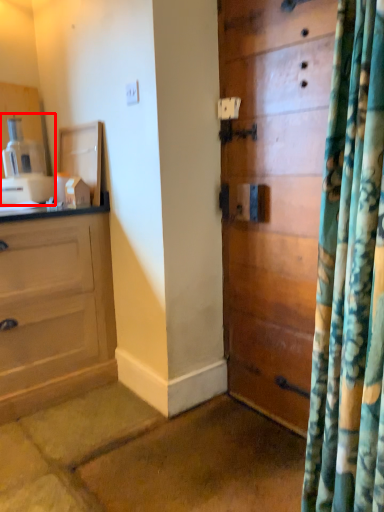
Question: From the image's perspective, what is the correct spatial positioning of coffee machine (annotated by the red box) in reference to door?

Choices:
 (A) above
 (B) below

Answer: (A)